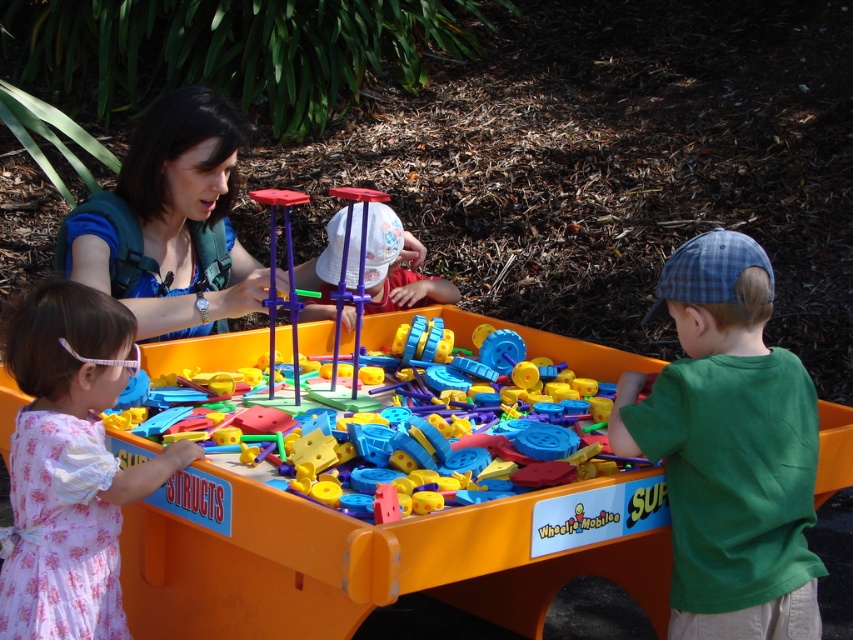
Question: Can you confirm if pink floral dress at lower left is positioned to the right of translucent plastic toy at center?

Choices:
 (A) no
 (B) yes

Answer: (A)

Question: Which object is farther from the camera taking this photo?

Choices:
 (A) blue fabric backpack at upper left
 (B) translucent plastic toy at center

Answer: (A)

Question: Is translucent plastic toy at center closer to camera compared to blue fabric backpack at upper left?

Choices:
 (A) yes
 (B) no

Answer: (A)

Question: Considering the real-world distances, which object is closest to the green cotton shirt at right?

Choices:
 (A) pink floral dress at lower left
 (B) blue fabric backpack at upper left
 (C) translucent plastic toy at center

Answer: (C)

Question: Which object appears closest to the camera in this image?

Choices:
 (A) translucent plastic toy at center
 (B) blue fabric backpack at upper left
 (C) pink floral dress at lower left
 (D) green cotton shirt at right

Answer: (A)

Question: Can you confirm if green cotton shirt at right is positioned to the left of pink floral dress at lower left?

Choices:
 (A) no
 (B) yes

Answer: (A)